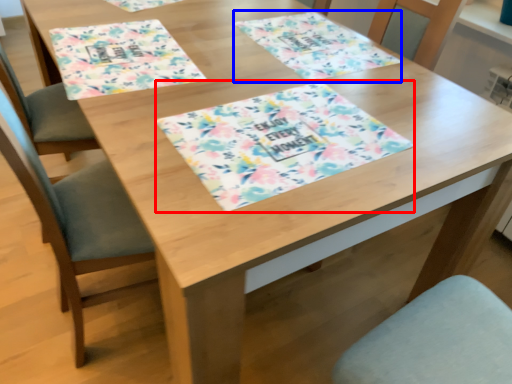
Question: Among these objects, which one is farthest to the camera, tablecloth (highlighted by a red box) or place mat (highlighted by a blue box)?

Choices:
 (A) tablecloth
 (B) place mat

Answer: (B)